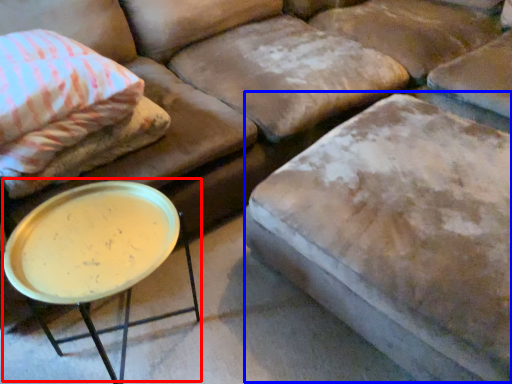
Question: Which of the following is the farthest to the observer, round table (highlighted by a red box) or swivel chair (highlighted by a blue box)?

Choices:
 (A) round table
 (B) swivel chair

Answer: (A)